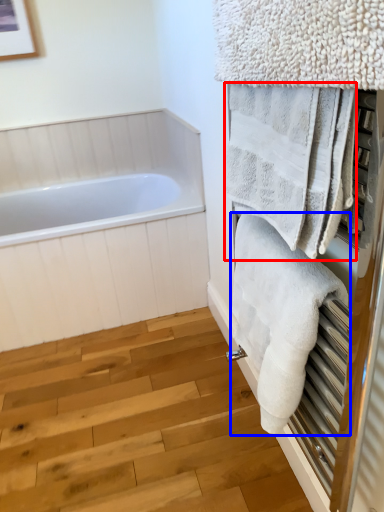
Question: Which object is further to the camera taking this photo, towel (highlighted by a red box) or towel (highlighted by a blue box)?

Choices:
 (A) towel
 (B) towel

Answer: (B)